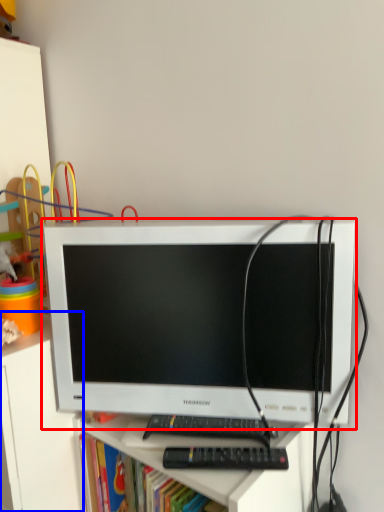
Question: Among these objects, which one is nearest to the camera, computer monitor (highlighted by a red box) or file cabinet (highlighted by a blue box)?

Choices:
 (A) computer monitor
 (B) file cabinet

Answer: (A)